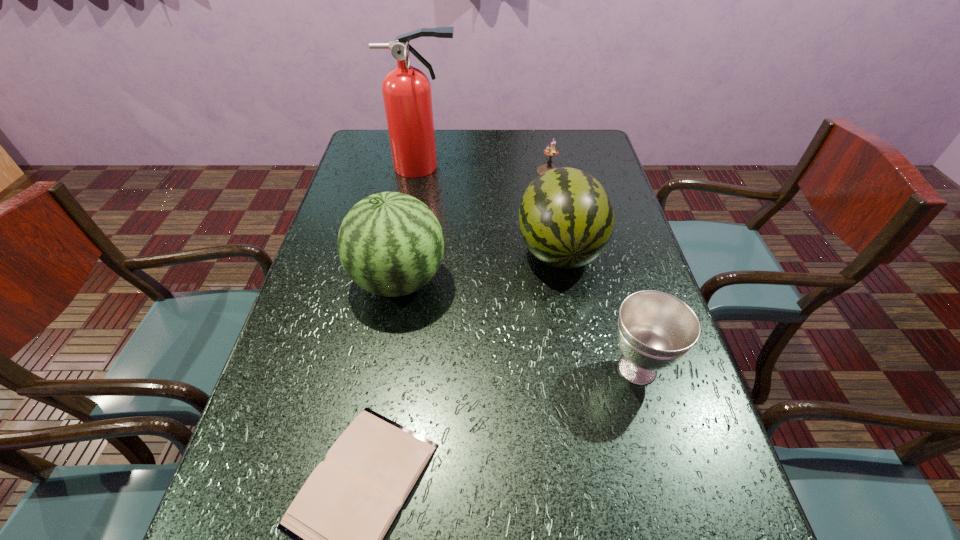
The image size is (960, 540). Identify the location of blank space located at the stem end of the shorter watermelon. (585, 388).

The height and width of the screenshot is (540, 960). I want to click on vacant space located 0.130m on the front of the fifth farthest object, so click(x=665, y=468).

The width and height of the screenshot is (960, 540). I want to click on vacant space located 0.170m on the left of the fifth tallest object, so click(x=484, y=171).

I want to click on fire extinguisher present at the far edge, so click(406, 90).

Locate an element on the screen. candle holder positioned at the far edge is located at coordinates point(549,151).

The image size is (960, 540). Identify the location of fire extinguisher present at the left edge. (406, 90).

At what (x,y) coordinates should I click in order to perform the action: click on watermelon present at the left edge. Please return your answer as a coordinate pair (x, y). Image resolution: width=960 pixels, height=540 pixels. Looking at the image, I should click on (390, 244).

Locate an element on the screen. Image resolution: width=960 pixels, height=540 pixels. watermelon positioned at the right edge is located at coordinates (566, 218).

Where is `chalice situated at the right edge`? Image resolution: width=960 pixels, height=540 pixels. chalice situated at the right edge is located at coordinates (655, 329).

At what (x,y) coordinates should I click in order to perform the action: click on candle holder at the right edge. Please return your answer as a coordinate pair (x, y). This screenshot has width=960, height=540. Looking at the image, I should click on (549, 151).